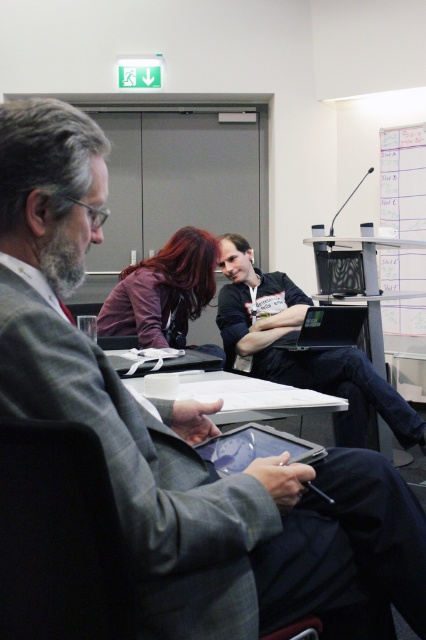
Describe the element at coordinates (163, 291) in the screenshot. I see `dark purple fabric shirt at center` at that location.

Which is more to the right, dark purple fabric shirt at center or black glossy tablet at center?

Positioned to the right is black glossy tablet at center.

Between point (181, 314) and point (313, 460), which one is positioned behind?

Point (181, 314)

The width and height of the screenshot is (426, 640). In order to click on dark purple fabric shirt at center in this screenshot , I will do `click(163, 291)`.

Is black glossy tablet at center taller than black glossy laptop at center?

Incorrect, black glossy tablet at center's height is not larger of black glossy laptop at center's.

Describe the element at coordinates (256, 448) in the screenshot. I see `black glossy tablet at center` at that location.

Who is more distant from viewer, (253, 429) or (319, 348)?

The point (319, 348) is behind.

The height and width of the screenshot is (640, 426). Find the location of `black glossy tablet at center`. black glossy tablet at center is located at coordinates (256, 448).

Between point (279, 276) and point (239, 456), which one is positioned behind?

Point (279, 276)

Does black fabric laptop at center appear over black glossy tablet at center?

Yes.

I want to click on black fabric laptop at center, so click(302, 352).